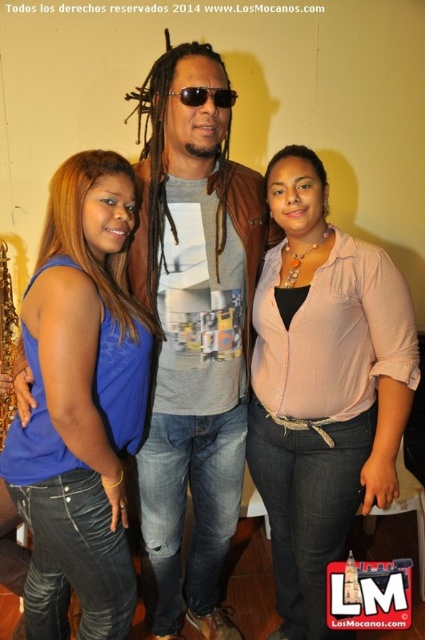
Is pink satin blouse at center smaller than brown leather jacket at center?

Yes.

From the picture: Between pink satin blouse at center and brown leather jacket at center, which one is positioned higher?

Positioned higher is brown leather jacket at center.

Who is more distant from viewer, (317, 230) or (210, 116)?

The point (317, 230) is more distant.

Where is `pink satin blouse at center`? This screenshot has width=425, height=640. pink satin blouse at center is located at coordinates (323, 387).

Between blue denim jeans at center and sunglasses at center, which one is positioned higher?

sunglasses at center is higher up.

Can you confirm if blue denim jeans at center is wider than sunglasses at center?

Yes.

This screenshot has height=640, width=425. What do you see at coordinates (81, 403) in the screenshot?
I see `blue denim jeans at center` at bounding box center [81, 403].

Where is `blue denim jeans at center`? This screenshot has width=425, height=640. blue denim jeans at center is located at coordinates (81, 403).

I want to click on pink satin blouse at center, so click(x=323, y=387).

Does point (289, 556) lie behind point (232, 100)?

Yes.

At what (x,y) coordinates should I click in order to perform the action: click on pink satin blouse at center. Please return your answer as a coordinate pair (x, y). The height and width of the screenshot is (640, 425). Looking at the image, I should click on (323, 387).